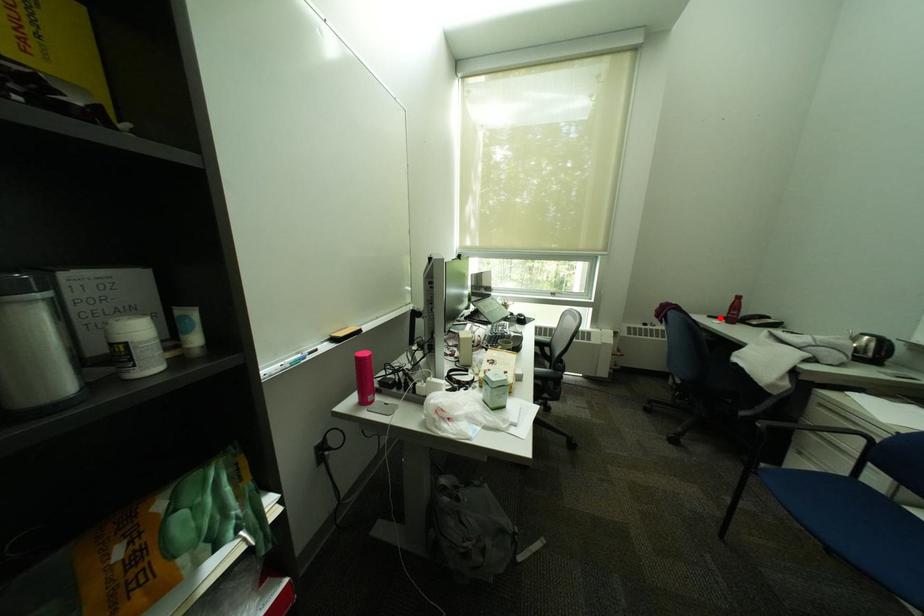
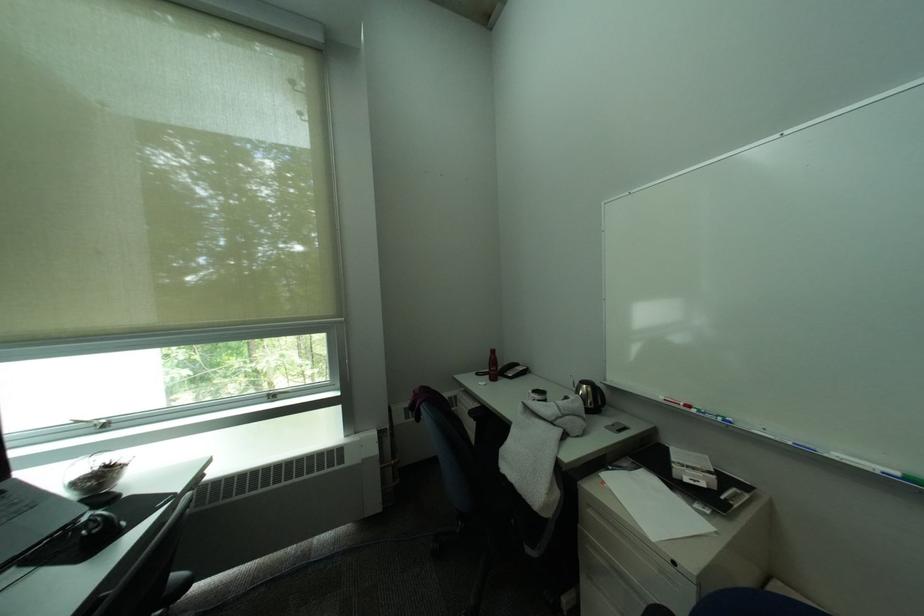
The point at the highlighted location is marked in the first image. Where is the corresponding point in the second image?

(488, 376)